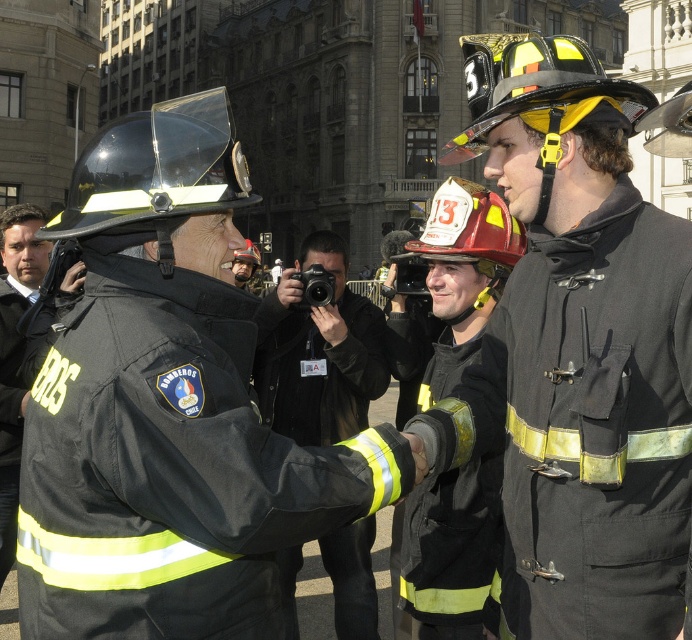
Can you confirm if black fabric camera at center is positioned to the left of black matte uniform at center?

Indeed, black fabric camera at center is positioned on the left side of black matte uniform at center.

Who is higher up, black fabric camera at center or black matte uniform at center?

black fabric camera at center is higher up.

I want to click on black fabric camera at center, so click(318, 353).

You are a GUI agent. You are given a task and a screenshot of the screen. Output one action in this format:
    pyautogui.click(x=<x>, y=<y>)
    Task: Click on the black fabric camera at center
    The height and width of the screenshot is (640, 692).
    Given the screenshot: What is the action you would take?
    pyautogui.click(x=318, y=353)

Is matte black helmet at center positioned in front of black fabric camera at center?

No, matte black helmet at center is further to the viewer.

Does matte black helmet at center appear on the right side of black fabric camera at center?

Indeed, matte black helmet at center is positioned on the right side of black fabric camera at center.

What do you see at coordinates (576, 352) in the screenshot? I see `matte black helmet at center` at bounding box center [576, 352].

I want to click on matte black helmet at center, so coord(576,352).

Can you confirm if black fabric camera at center is shorter than black matte uniform at left?

Incorrect, black fabric camera at center's height does not fall short of black matte uniform at left's.

Where is `black fabric camera at center`? This screenshot has height=640, width=692. black fabric camera at center is located at coordinates (318, 353).